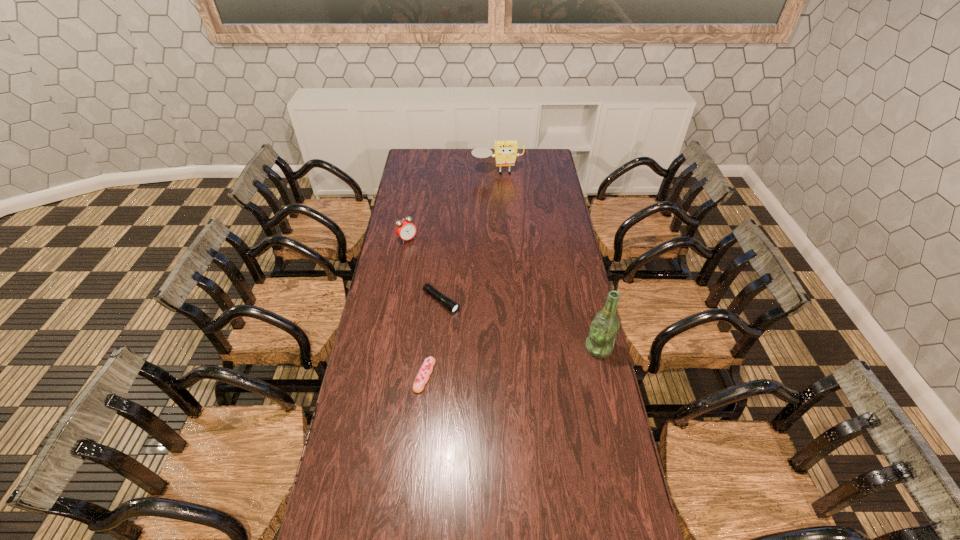
This screenshot has width=960, height=540. What are the coordinates of `free space between the flashlight and the third tallest object` in the screenshot? It's located at (424, 271).

Find the location of a particular element. The height and width of the screenshot is (540, 960). free space between the eclair and the flashlight is located at coordinates (433, 339).

The image size is (960, 540). Identify the location of free area in between the sponge and the beer bottle. (548, 261).

Image resolution: width=960 pixels, height=540 pixels. In order to click on free point between the eclair and the beer bottle in this screenshot , I will do `click(512, 362)`.

I want to click on free space between the beer bottle and the eclair, so click(512, 362).

Where is `vacant area between the fourth object from left to right and the second farthest object`? The image size is (960, 540). vacant area between the fourth object from left to right and the second farthest object is located at coordinates (452, 206).

Where is `free space between the flashlight and the rightmost object`? The image size is (960, 540). free space between the flashlight and the rightmost object is located at coordinates (520, 325).

Where is `empty location between the leftmost object and the tallest object`? The height and width of the screenshot is (540, 960). empty location between the leftmost object and the tallest object is located at coordinates (503, 294).

The width and height of the screenshot is (960, 540). In order to click on the third closest object relative to the flashlight in this screenshot , I will do `click(603, 330)`.

Point out which object is positioned as the second nearest to the rightmost object. Please provide its 2D coordinates. Your answer should be formatted as a tuple, i.e. [(x, y)], where the tuple contains the x and y coordinates of a point satisfying the conditions above.

[(426, 369)]